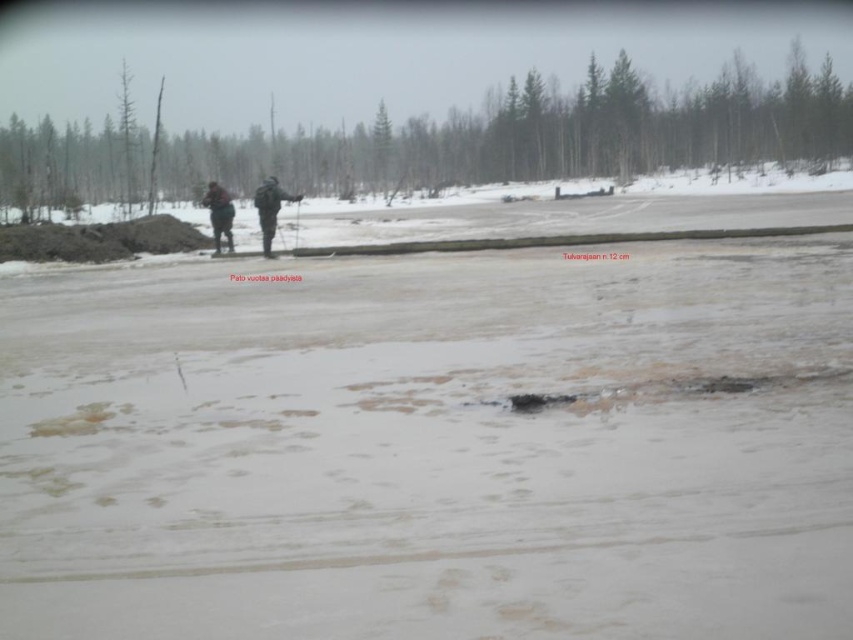
You are a hiker trying to cross the snow area. There is a translucent ice at center. Is the ice at center slippery?

The translucent ice at center is slippery because it is ice.

You are a hiker planning to walk through the snow in the direction the two people are going. You see the translucent ice at center and the dark gray jacket at center. Which object is smaller in size?

The translucent ice at center is smaller than the dark gray jacket at center.

You are navigating a snowy path and see two points marked on your map. The first point is at coordinates point [227,228] and the second point is at point [267,248]. According to the image, which point is closer to your current position if you are facing the direction the individuals are walking?

Point [227,228] is behind point [267,248], so the closer point to your current position would be point [267,248] since you are facing the direction the individuals are walking towards the trees.